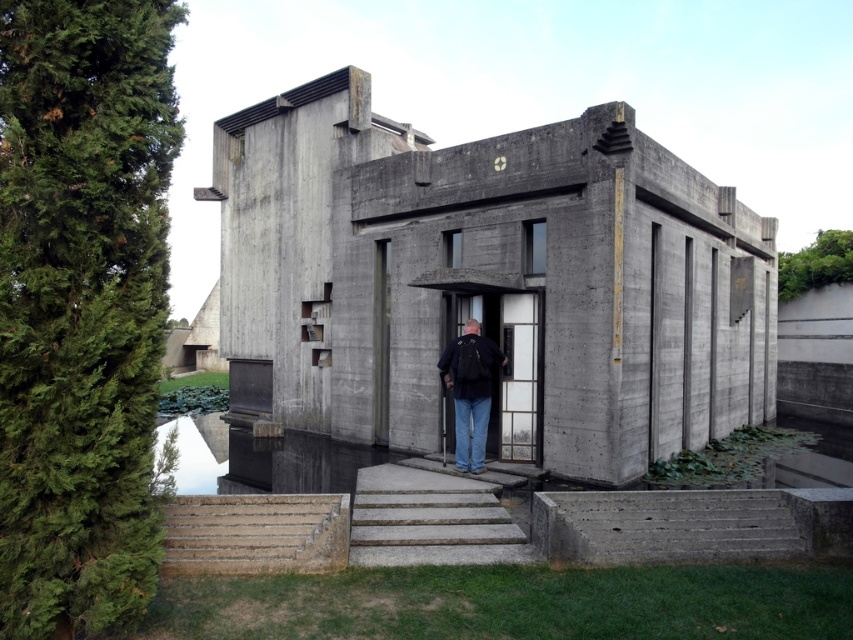
You are standing at the entrance of the modernist concrete building and see a point marked at coordinates (254,532). Based on the scene description, where exactly is this point located?

The point is located on the concrete steps at the lower left.